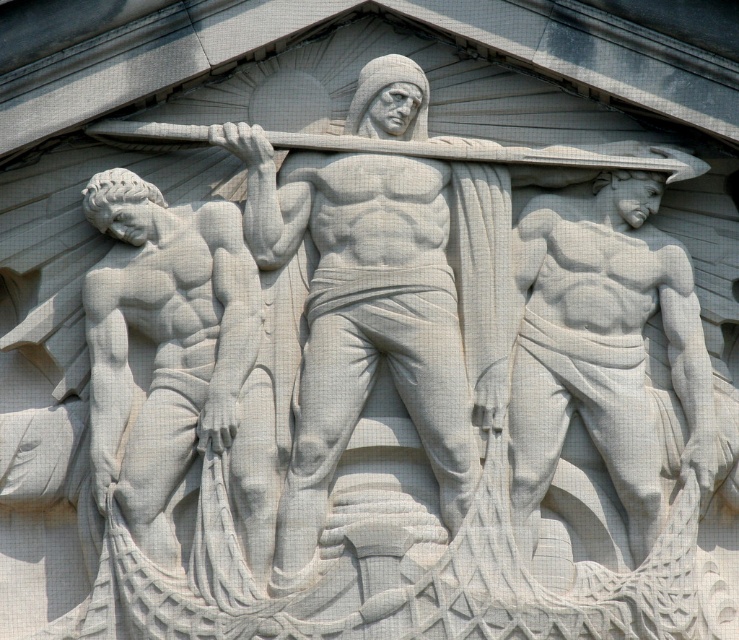
Question: Is smooth white statue at left to the left of matte white statue at right from the viewer's perspective?

Choices:
 (A) no
 (B) yes

Answer: (B)

Question: Is smooth white statue at left smaller than matte white statue at right?

Choices:
 (A) yes
 (B) no

Answer: (A)

Question: Can you confirm if smooth white statue at left is wider than matte white statue at right?

Choices:
 (A) yes
 (B) no

Answer: (B)

Question: Which point appears farthest from the camera in this image?

Choices:
 (A) (701, 397)
 (B) (251, 506)

Answer: (A)

Question: Among these points, which one is farthest from the camera?

Choices:
 (A) (231, 328)
 (B) (537, 200)

Answer: (B)